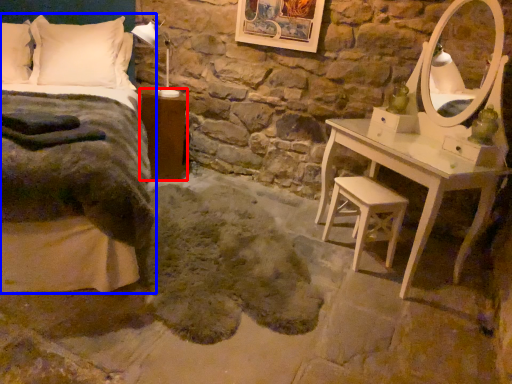
Question: Among these objects, which one is nearest to the camera, nightstand (highlighted by a red box) or bed (highlighted by a blue box)?

Choices:
 (A) nightstand
 (B) bed

Answer: (B)